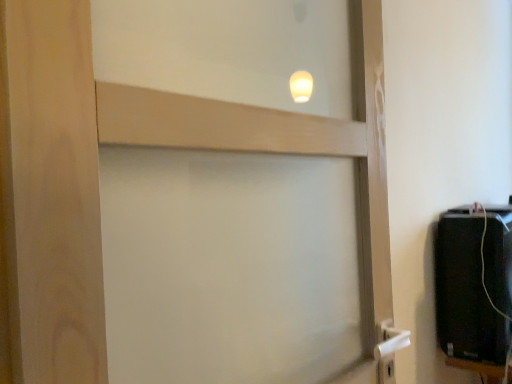
In order to face black plastic speaker at lower right, should I rotate leftwards or rightwards?

To align with it, rotate right about 27.996°.

The height and width of the screenshot is (384, 512). Describe the element at coordinates (474, 282) in the screenshot. I see `black plastic speaker at lower right` at that location.

You are a GUI agent. You are given a task and a screenshot of the screen. Output one action in this format:
    pyautogui.click(x=<x>, y=<y>)
    Task: Click on the black plastic speaker at lower right
    
    Given the screenshot: What is the action you would take?
    pyautogui.click(x=474, y=282)

Where is `black plastic speaker at lower right`? Image resolution: width=512 pixels, height=384 pixels. black plastic speaker at lower right is located at coordinates (474, 282).